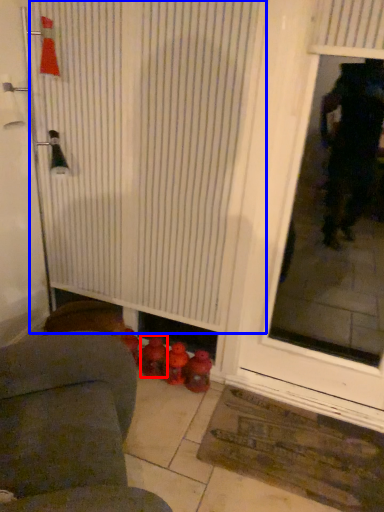
Question: Which of the following is the farthest to the observer, toy (highlighted by a red box) or shower curtain (highlighted by a blue box)?

Choices:
 (A) toy
 (B) shower curtain

Answer: (A)